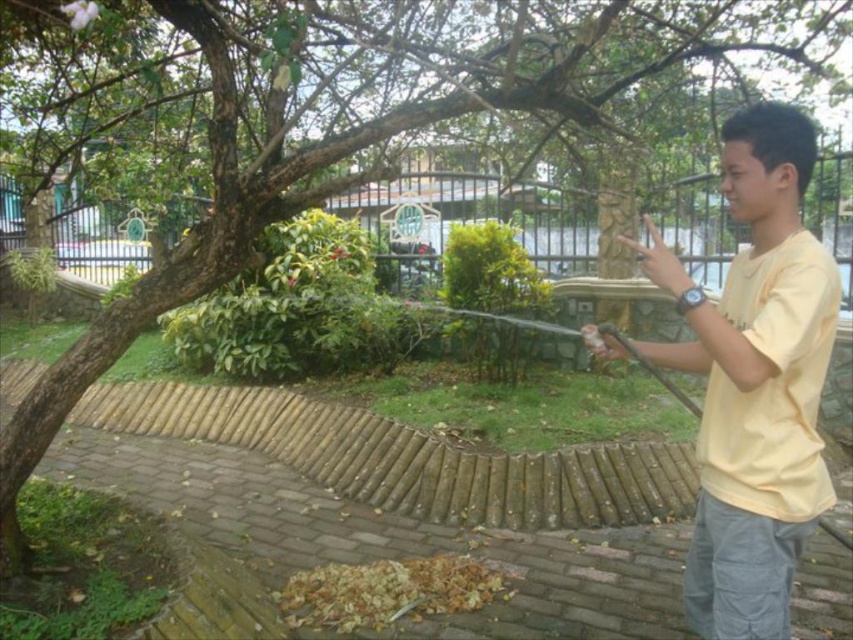
Question: Is yellow cotton shirt at right further to the viewer compared to black metal fence at upper center?

Choices:
 (A) yes
 (B) no

Answer: (B)

Question: Is yellow cotton shirt at right thinner than black metal fence at upper center?

Choices:
 (A) no
 (B) yes

Answer: (A)

Question: Does yellow cotton shirt at right appear over black metal fence at upper center?

Choices:
 (A) yes
 (B) no

Answer: (B)

Question: Which point is farther to the camera?

Choices:
 (A) yellow cotton shirt at right
 (B) black metal fence at upper center

Answer: (B)

Question: Which object appears farthest from the camera in this image?

Choices:
 (A) yellow cotton shirt at right
 (B) black metal fence at upper center

Answer: (B)

Question: Which point appears closest to the camera in this image?

Choices:
 (A) (757, 392)
 (B) (590, 212)

Answer: (A)